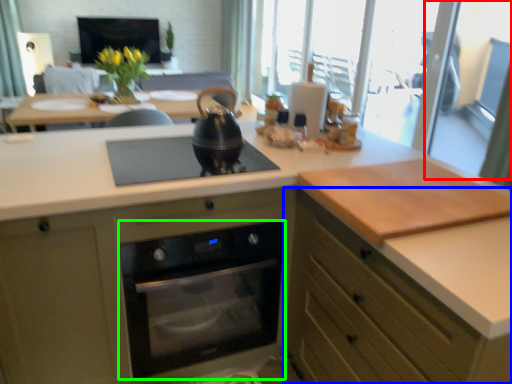
Question: Based on their relative distances, which object is nearer to screen door (highlighted by a red box)? Choose from cabinetry (highlighted by a blue box) and home appliance (highlighted by a green box).

Choices:
 (A) cabinetry
 (B) home appliance

Answer: (B)